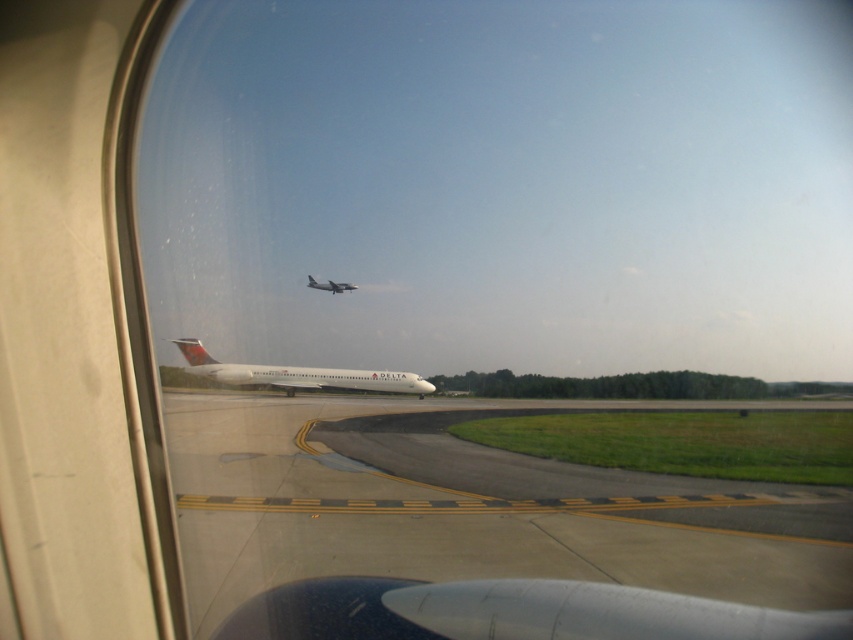
Question: Which of these objects is positioned closest to the white matte airplane at center?

Choices:
 (A) white glossy airplane at center
 (B) smooth asphalt tarmac at center

Answer: (A)

Question: Considering the relative positions of smooth asphalt tarmac at center and white glossy airplane at center in the image provided, where is smooth asphalt tarmac at center located with respect to white glossy airplane at center?

Choices:
 (A) right
 (B) left

Answer: (A)

Question: Among these objects, which one is farthest from the camera?

Choices:
 (A) white matte airplane at center
 (B) smooth asphalt tarmac at center
 (C) white glossy airplane at center

Answer: (A)

Question: From the image, what is the correct spatial relationship of white glossy airplane at center in relation to white matte airplane at center?

Choices:
 (A) left
 (B) right

Answer: (B)

Question: Estimate the real-world distances between objects in this image. Which object is closer to the smooth asphalt tarmac at center?

Choices:
 (A) white glossy airplane at center
 (B) white matte airplane at center

Answer: (A)

Question: Is smooth asphalt tarmac at center to the right of white matte airplane at center from the viewer's perspective?

Choices:
 (A) yes
 (B) no

Answer: (A)